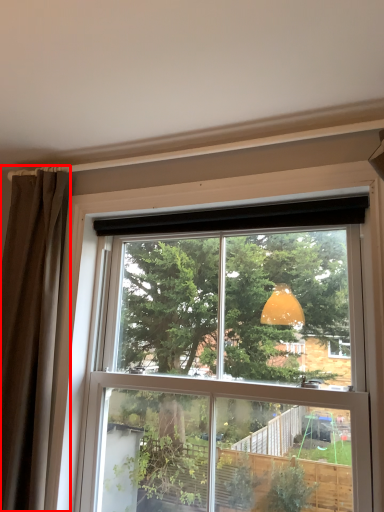
Question: Where is curtain (annotated by the red box) located in relation to window in the image?

Choices:
 (A) left
 (B) right

Answer: (A)